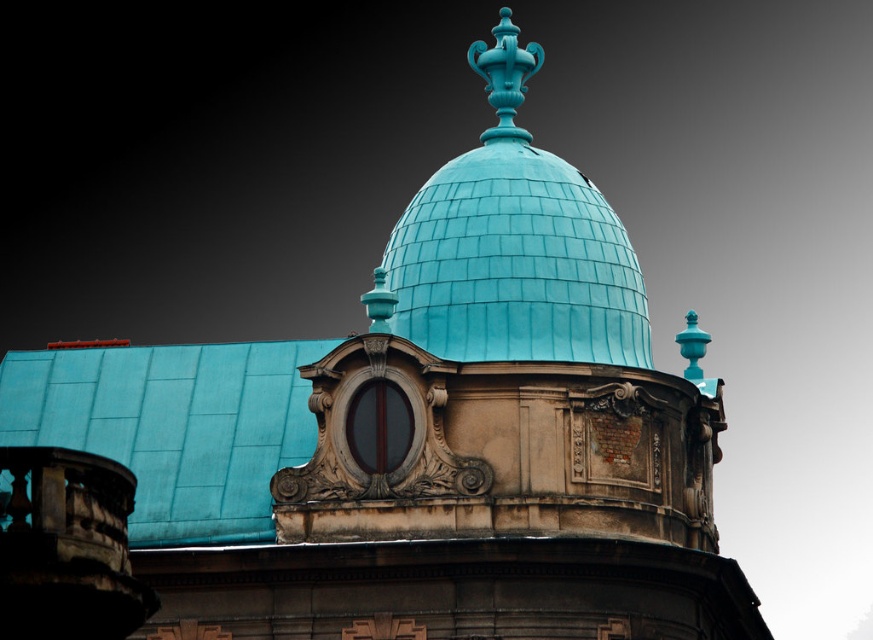
You are an architect designing a model of this building. You have both the teal shingled dome at center and the matte turquoise vase at center. Which object should you scale down more to maintain the building proportions?

The matte turquoise vase at center should be scaled down more because the teal shingled dome at center is larger in size compared to the matte turquoise vase at center, so reducing the vase more would preserve their proportional relationship.

From the picture: You are standing in front of the building and want to determine which of the two points, point (514, 253) or point (497, 54), is closer to you. Based on the architectural details described, which point is nearer?

Point (514, 253) is closer to the viewer than point (497, 54).

You are standing in front of a building and want to take a photo of the teal shingled dome at center. If you are currently 225.89 feet away from it, is the dome within a typical smartphone camera focus range?

The teal shingled dome at center is 225.89 feet away from the viewer. Most smartphone cameras have a focus range that can handle distances up to several hundred feet, so the dome should be within the typical focus range and appear sharp in the photo.